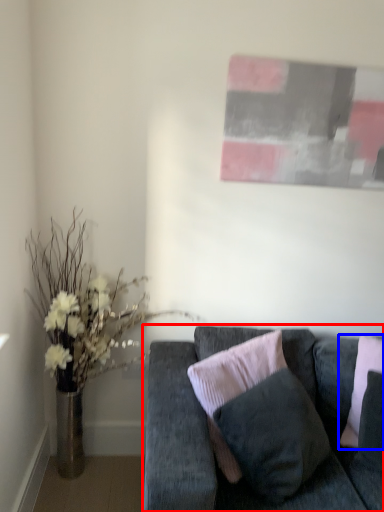
Question: Which point is closer to the camera, studio couch (highlighted by a red box) or pillow (highlighted by a blue box)?

Choices:
 (A) studio couch
 (B) pillow

Answer: (A)